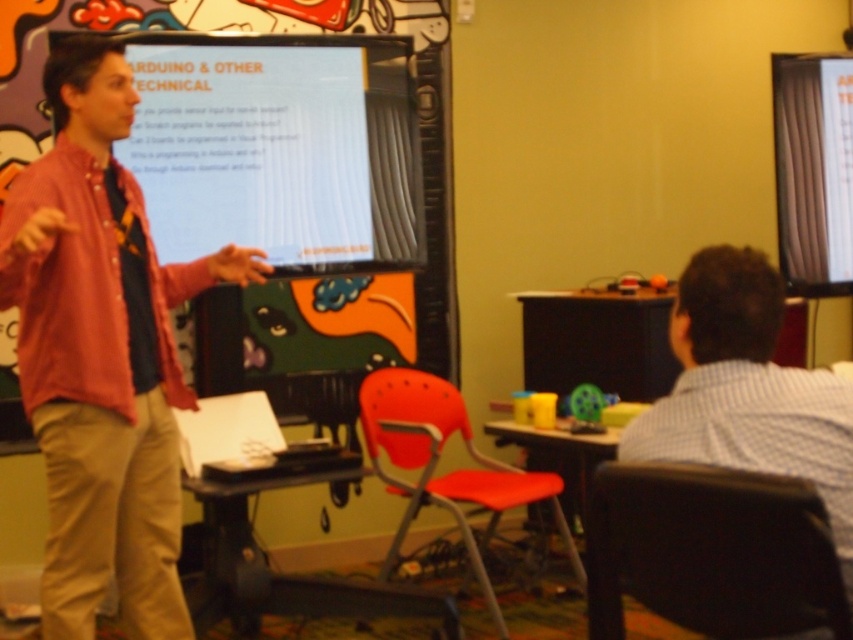
Question: Which point is farther to the camera?

Choices:
 (A) white striped shirt at right
 (B) matte red shirt at center

Answer: (B)

Question: Estimate the real-world distances between objects in this image. Which object is farther from the white striped shirt at right?

Choices:
 (A) matte red shirt at center
 (B) matte black projector screen at upper right
 (C) white glossy projector screen at upper center

Answer: (B)

Question: Which point appears farthest from the camera in this image?

Choices:
 (A) (393, 173)
 (B) (416, 387)

Answer: (B)

Question: From the image, what is the correct spatial relationship of orange plastic chair at center in relation to matte black projector screen at upper right?

Choices:
 (A) below
 (B) above

Answer: (A)

Question: Observing the image, what is the correct spatial positioning of white glossy projector screen at upper center in reference to matte black projector screen at upper right?

Choices:
 (A) left
 (B) right

Answer: (A)

Question: Can you confirm if white glossy projector screen at upper center is positioned above matte black projector screen at upper right?

Choices:
 (A) no
 (B) yes

Answer: (B)